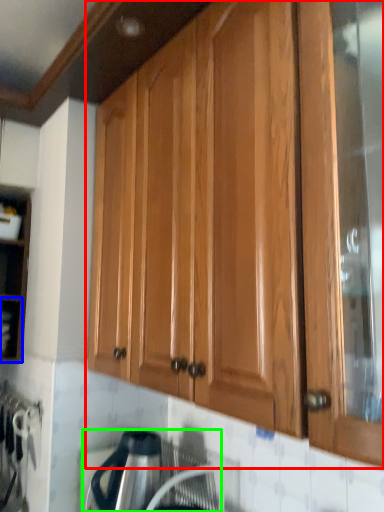
Question: Which object is positioned closest to cabinetry (highlighted by a red box)? Select from shelf (highlighted by a blue box) and appliance (highlighted by a green box).

Choices:
 (A) shelf
 (B) appliance

Answer: (B)